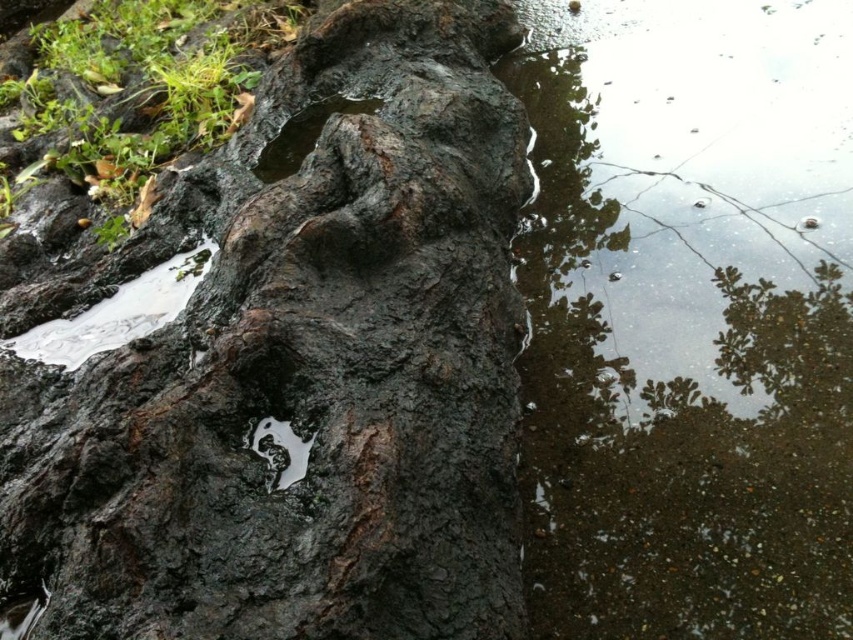
You are standing in front of the rock and want to place a small stone on the dark brown rough bark at center and the white glossy puddle at center. Which surface would you choose to place it so that the stone won

The dark brown rough bark at center is to the left of the white glossy puddle at center. Since the dark brown rough bark at center has a rough texture, it would provide a stable surface for placing the stone, whereas the white glossy puddle at center is a liquid surface and cannot support the stone.

You are standing near the large dark rock and want to step onto the clear water at lower right. However, you need to know if it is wider than the white glossy puddle at center to avoid slipping. Can you confirm which one is wider?

The clear water at lower right might be wider than the white glossy puddle at center, so it is possibly wider and safer to step on.

You are standing 2 meters away from the rock. Can you reach the point at coordinates point [699,314] on the rock without moving closer?

The distance of point [699,314] from the camera is 1.94 meters, so you are already 2 meters away from the rock. Therefore, you cannot reach the point without moving closer.